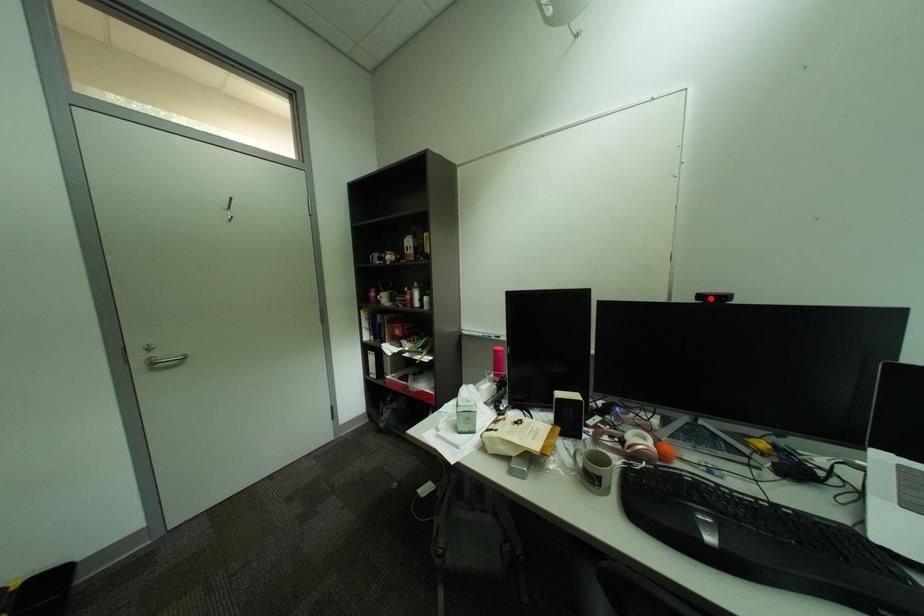
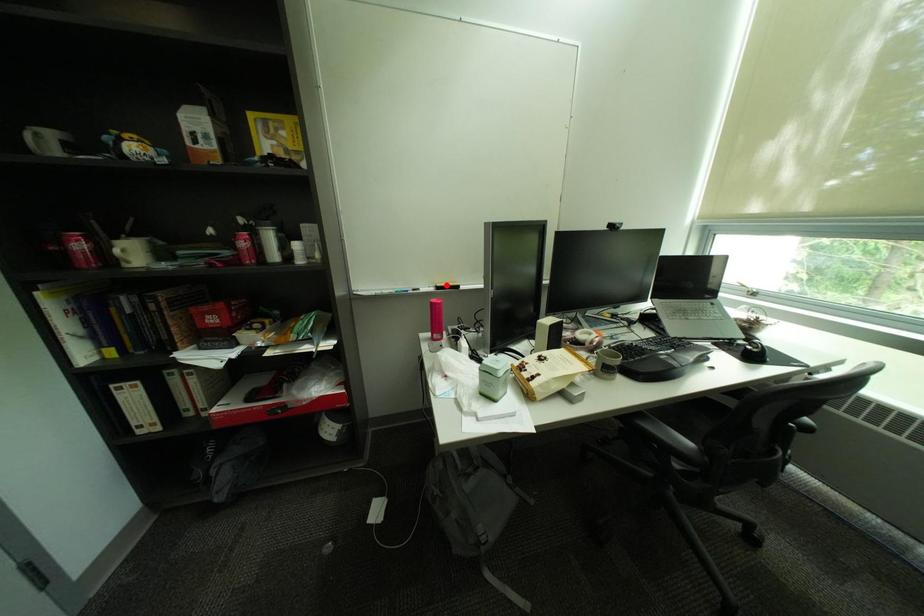
I am providing you with two images of the same scene from different viewpoints. A red point is marked on the first image and another point is marked on the second image. Is the red point in image1 aligned with the point shown in image2?

No